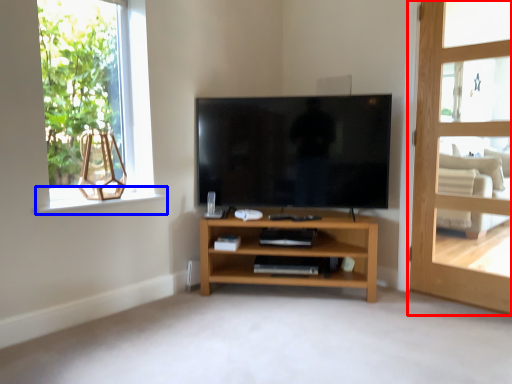
Question: Which object appears farthest to the camera in this image, door (highlighted by a red box) or window sill (highlighted by a blue box)?

Choices:
 (A) door
 (B) window sill

Answer: (B)